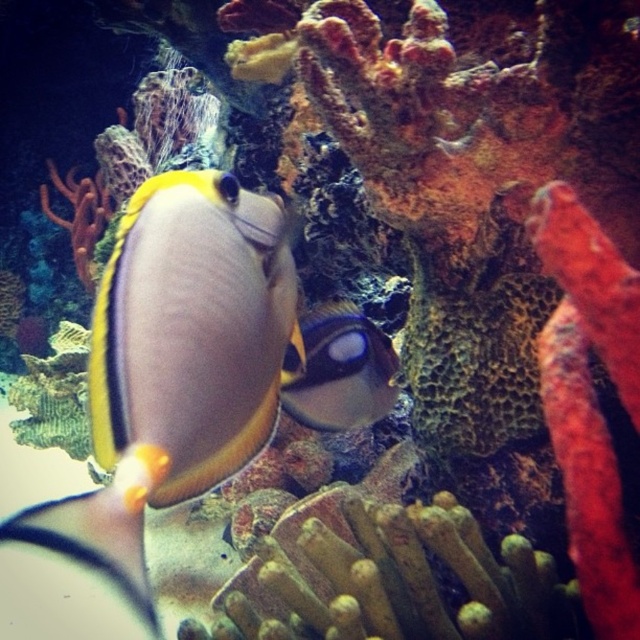
Does point (195, 259) lie in front of point (333, 380)?

Yes, point (195, 259) is in front of point (333, 380).

Find the location of a particular element. shiny yellow and black fish at center is located at coordinates (193, 328).